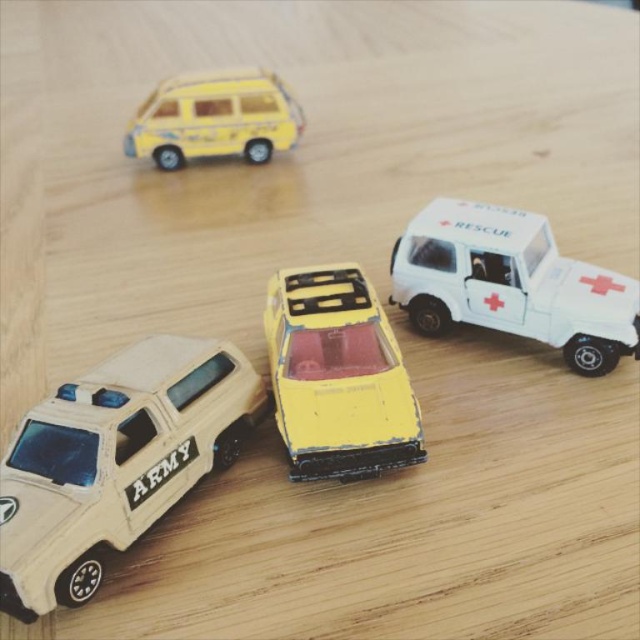
You are organizing a toy car race and want to ensure all cars fit on the track. The track has a width limit of 10 cm. If the yellow matte van at upper left is wider than the yellow matte car at center, which vehicle might not fit on the track?

The yellow matte van at upper left might not fit on the track since it is wider than the yellow matte car at center, and if the track has a 10 cm width limit, the van could exceed that limit.

You are organizing a toy car display and want to place the white matte rescue car at upper right next to the yellow matte van at upper left. Considering their sizes, which one should you place first to ensure they fit properly?

The white matte rescue car at upper right is larger than the yellow matte van at upper left, so you should place the white matte rescue car at upper right first to accommodate its size.